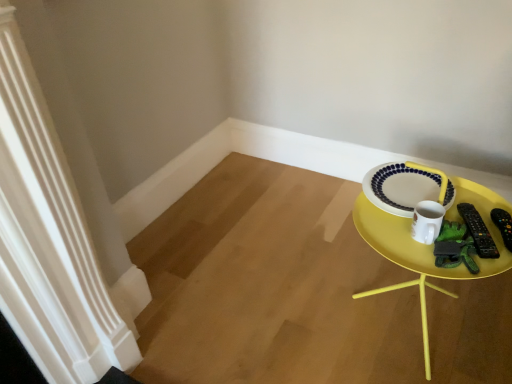
Question: Would you say black plastic remote control at right, the 1th remote control from the left, contains white glossy mug at right?

Choices:
 (A) no
 (B) yes

Answer: (A)

Question: From the image's perspective, would you say black plastic remote control at right, which is the second remote control from right to left, is shown under white glossy mug at right?

Choices:
 (A) no
 (B) yes

Answer: (B)

Question: Could you tell me if black plastic remote control at right, the 1th remote control from the left, is facing white glossy mug at right?

Choices:
 (A) no
 (B) yes

Answer: (A)

Question: Is black plastic remote control at right, which is the second remote control from right to left, far from white glossy mug at right?

Choices:
 (A) no
 (B) yes

Answer: (A)

Question: Can you confirm if black plastic remote control at right, which is the second remote control from right to left, is wider than white glossy mug at right?

Choices:
 (A) no
 (B) yes

Answer: (B)

Question: From a real-world perspective, is black plastic remote control at right, the 1th remote control from the left, on white glossy mug at right?

Choices:
 (A) yes
 (B) no

Answer: (B)

Question: From a real-world perspective, is white glossy mug at right positioned under white glossy plate at upper right based on gravity?

Choices:
 (A) no
 (B) yes

Answer: (A)

Question: Can you confirm if white glossy mug at right is thinner than white glossy plate at upper right?

Choices:
 (A) no
 (B) yes

Answer: (B)

Question: From the image's perspective, would you say white glossy mug at right is positioned over white glossy plate at upper right?

Choices:
 (A) no
 (B) yes

Answer: (A)

Question: Is there a large distance between white glossy mug at right and white glossy plate at upper right?

Choices:
 (A) no
 (B) yes

Answer: (A)

Question: Is white glossy mug at right at the left side of white glossy plate at upper right?

Choices:
 (A) yes
 (B) no

Answer: (A)

Question: Does white glossy mug at right touch white glossy plate at upper right?

Choices:
 (A) yes
 (B) no

Answer: (A)

Question: Considering the relative sizes of yellow plastic tray at right and black plastic remote control at right, the 1th remote control in the right-to-left sequence, in the image provided, is yellow plastic tray at right bigger than black plastic remote control at right, the 1th remote control in the right-to-left sequence,?

Choices:
 (A) yes
 (B) no

Answer: (A)